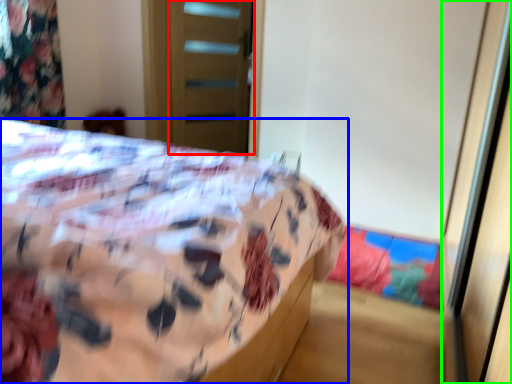
Question: Which is nearer to the screen door (highlighted by a red box)? bed (highlighted by a blue box) or screen door (highlighted by a green box).

Choices:
 (A) bed
 (B) screen door

Answer: (A)